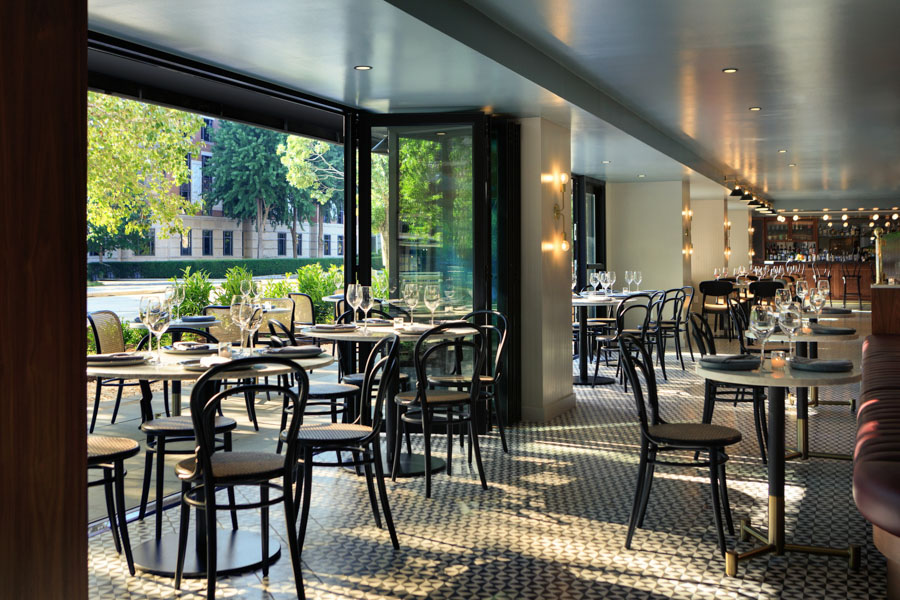
What are the coordinates of `floor` in the screenshot? It's located at [x=582, y=557].